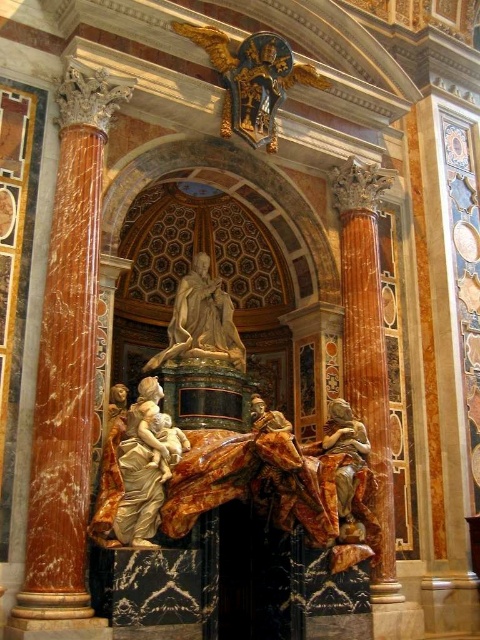
Question: Does gold leaf angel at upper center appear over polished marble statue at center?

Choices:
 (A) yes
 (B) no

Answer: (A)

Question: Among these objects, which one is nearest to the camera?

Choices:
 (A) gold leaf angel at upper center
 (B) marble column at left
 (C) polished marble statue at center
 (D) golden marble statue at lower left

Answer: (B)

Question: Can you confirm if golden marble statue at lower left is thinner than polished marble statue at center?

Choices:
 (A) yes
 (B) no

Answer: (A)

Question: Estimate the real-world distances between objects in this image. Which object is farther from the golden polished statue at center?

Choices:
 (A) gold leaf angel at upper center
 (B) polished marble statue at center
 (C) golden marble statue at lower left

Answer: (A)

Question: Which point is farther from the camera taking this photo?

Choices:
 (A) (222, 308)
 (B) (348, 429)
 (C) (105, 547)
 (D) (56, 408)

Answer: (A)

Question: Is golden marble statue at lower left further to camera compared to polished marble statue at center?

Choices:
 (A) yes
 (B) no

Answer: (B)